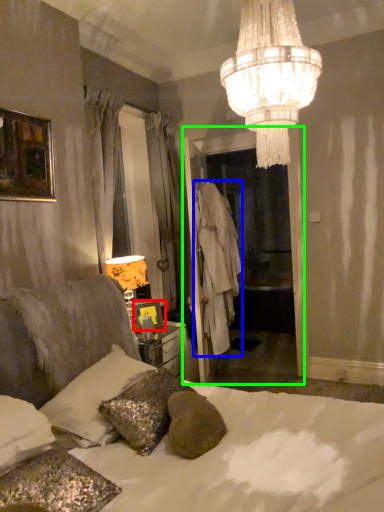
Question: Which object is positioned closest to picture frame (highlighted by a red box)? Select from robe (highlighted by a blue box) and glass door (highlighted by a green box).

Choices:
 (A) robe
 (B) glass door

Answer: (B)